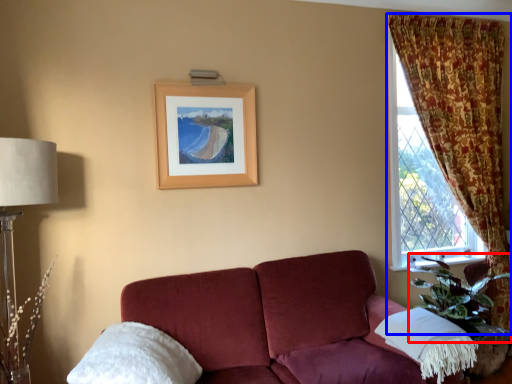
Question: Which object appears closest to the camera in this image, plant (highlighted by a red box) or curtain (highlighted by a blue box)?

Choices:
 (A) plant
 (B) curtain

Answer: (A)